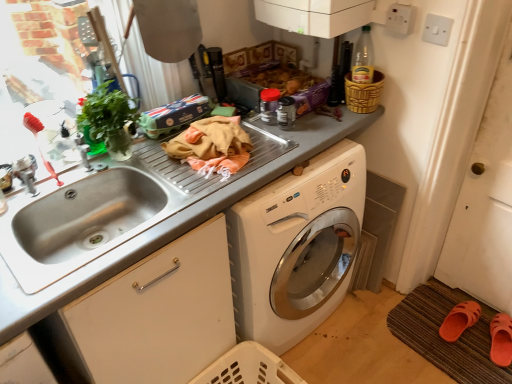
This screenshot has width=512, height=384. What are the coordinates of `vacant space to the right of green leafy plant at left` in the screenshot? It's located at (157, 166).